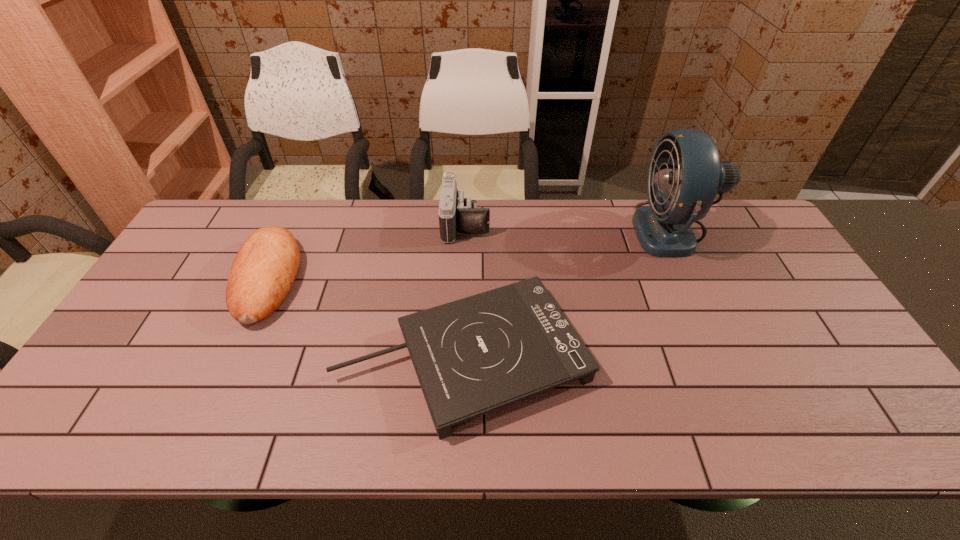
Find the location of `fan`. fan is located at coordinates (678, 196).

You are a GUI agent. You are given a task and a screenshot of the screen. Output one action in this format:
    pyautogui.click(x=<x>, y=<y>)
    Task: Click on the tallest object
    The width and height of the screenshot is (960, 540).
    Given the screenshot: What is the action you would take?
    pyautogui.click(x=678, y=196)

Where is `camera`? The height and width of the screenshot is (540, 960). camera is located at coordinates (456, 214).

The height and width of the screenshot is (540, 960). I want to click on bread, so click(264, 269).

Locate an element on the screen. This screenshot has height=540, width=960. the leftmost object is located at coordinates (264, 269).

The image size is (960, 540). Identify the location of the shortest object. (474, 355).

Locate an element on the screen. This screenshot has height=540, width=960. vacant space located 0.180m in front of the fan to blow air is located at coordinates [x=580, y=230].

Find the location of a particular element. This screenshot has width=960, height=540. vacant area situated 0.300m in front of the fan to blow air is located at coordinates (543, 230).

Locate an element on the screen. The width and height of the screenshot is (960, 540). vacant space situated 0.330m in front of the fan to blow air is located at coordinates (535, 230).

Identify the location of vacant region located 0.070m at the front of the camera with an open lens cover. The width and height of the screenshot is (960, 540). (510, 224).